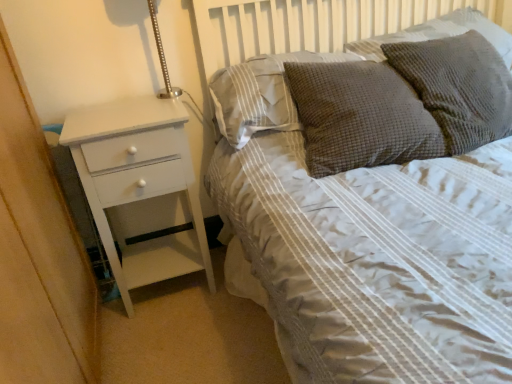
Question: Is textured gray pillow at upper right, the 4th pillow viewed from the left, completely or partially inside white painted wood chest of drawers at left?

Choices:
 (A) yes
 (B) no

Answer: (B)

Question: Is white painted wood chest of drawers at left next to textured gray pillow at upper right, the 4th pillow viewed from the left?

Choices:
 (A) no
 (B) yes

Answer: (A)

Question: From the image's perspective, is white painted wood chest of drawers at left over textured gray pillow at upper right, the 4th pillow viewed from the left?

Choices:
 (A) yes
 (B) no

Answer: (B)

Question: Does white painted wood chest of drawers at left have a greater width compared to textured gray pillow at upper right, the 1th pillow when ordered from right to left?

Choices:
 (A) no
 (B) yes

Answer: (A)

Question: Is white painted wood chest of drawers at left thinner than textured gray pillow at upper right, the 1th pillow when ordered from right to left?

Choices:
 (A) no
 (B) yes

Answer: (B)

Question: From their relative heights in the image, would you say textured gray pillow at upper right, the 4th pillow viewed from the left, is taller or shorter than brown textured pillow at upper right, which is the 3th pillow in right-to-left order?

Choices:
 (A) tall
 (B) short

Answer: (B)

Question: Is point (449, 16) closer or farther from the camera than point (387, 82)?

Choices:
 (A) closer
 (B) farther

Answer: (B)

Question: Would you say textured gray pillow at upper right, the 4th pillow viewed from the left, is inside or outside brown textured pillow at upper right, which is the 3th pillow in right-to-left order?

Choices:
 (A) outside
 (B) inside

Answer: (A)

Question: Is textured gray pillow at upper right, the 4th pillow viewed from the left, to the left or to the right of brown textured pillow at upper right, placed as the 2th pillow when sorted from left to right, in the image?

Choices:
 (A) right
 (B) left

Answer: (A)

Question: Is white painted wood chest of drawers at left inside the boundaries of brown textured pillow at upper center, which is counted as the fourth pillow, starting from the right, or outside?

Choices:
 (A) inside
 (B) outside

Answer: (B)

Question: From the image's perspective, is white painted wood chest of drawers at left positioned above or below brown textured pillow at upper center, which is counted as the fourth pillow, starting from the right?

Choices:
 (A) below
 (B) above

Answer: (A)

Question: Looking at the image, does white painted wood chest of drawers at left seem bigger or smaller compared to brown textured pillow at upper center, which is the 1th pillow from left to right?

Choices:
 (A) small
 (B) big

Answer: (B)

Question: Is point (112, 117) positioned closer to the camera than point (258, 87)?

Choices:
 (A) farther
 (B) closer

Answer: (B)

Question: Is brown textured pillow at upper center, which is the 1th pillow from left to right, in front of or behind white painted wood chest of drawers at left in the image?

Choices:
 (A) front
 (B) behind

Answer: (B)

Question: From the image's perspective, is brown textured pillow at upper center, which is the 1th pillow from left to right, located above or below white painted wood chest of drawers at left?

Choices:
 (A) above
 (B) below

Answer: (A)